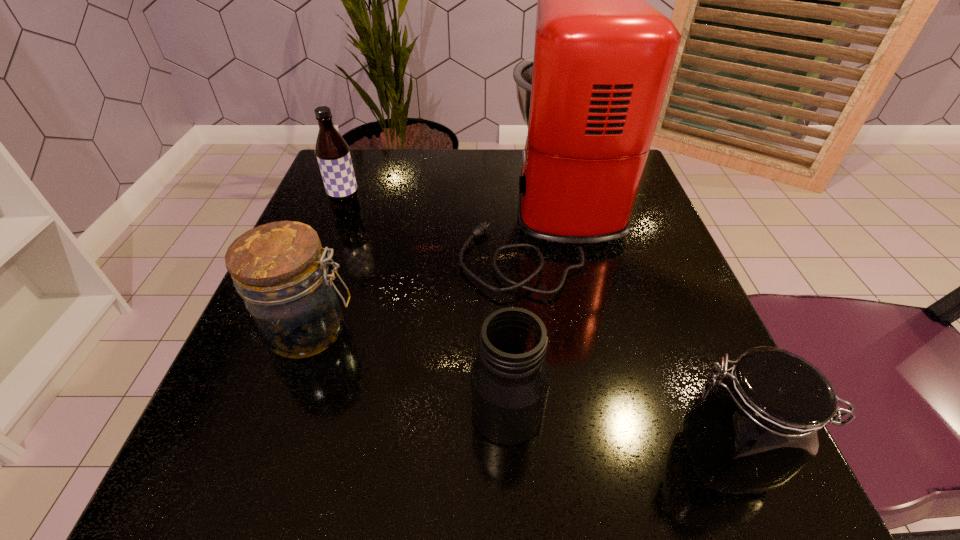
In order to click on free space between the third nearest object and the second jar from left to right in this screenshot , I will do `click(409, 371)`.

At what (x,y) coordinates should I click in order to perform the action: click on free spot between the farthest jar and the kitchen mixer. Please return your answer as a coordinate pair (x, y). This screenshot has width=960, height=540. Looking at the image, I should click on (427, 270).

You are a GUI agent. You are given a task and a screenshot of the screen. Output one action in this format:
    pyautogui.click(x=<x>, y=<y>)
    Task: Click on the free area in between the rightmost jar and the kitchen mixer
    
    Given the screenshot: What is the action you would take?
    pyautogui.click(x=633, y=334)

You are a GUI agent. You are given a task and a screenshot of the screen. Output one action in this format:
    pyautogui.click(x=<x>, y=<y>)
    Task: Click on the free point between the second jar from right to left and the third nearest object
    This screenshot has height=540, width=960.
    Given the screenshot: What is the action you would take?
    pyautogui.click(x=409, y=371)

Find the location of a particular element. This screenshot has width=960, height=540. empty space that is in between the second jar from right to left and the farthest jar is located at coordinates (409, 371).

Find the location of a particular element. The height and width of the screenshot is (540, 960). free spot between the third nearest object and the second jar from left to right is located at coordinates (409, 371).

Where is `free area in between the rightmost jar and the tallest object`? Image resolution: width=960 pixels, height=540 pixels. free area in between the rightmost jar and the tallest object is located at coordinates (633, 334).

Locate an element on the screen. This screenshot has width=960, height=540. the second closest object to the kitchen mixer is located at coordinates (510, 378).

Image resolution: width=960 pixels, height=540 pixels. Find the location of `the fourth closest object to the third farthest object`. the fourth closest object to the third farthest object is located at coordinates (752, 430).

Locate which jar ranks second in proximity to the third farthest object. Please provide its 2D coordinates. Your answer should be formatted as a tuple, i.e. [(x, y)], where the tuple contains the x and y coordinates of a point satisfying the conditions above.

[(752, 430)]